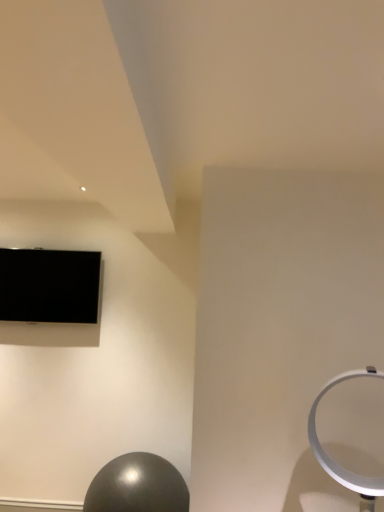
Question: Would you say shiny metallic ball at lower left is inside or outside black glossy tv at upper left?

Choices:
 (A) inside
 (B) outside

Answer: (B)

Question: From a real-world perspective, is shiny metallic ball at lower left physically located above or below black glossy tv at upper left?

Choices:
 (A) above
 (B) below

Answer: (B)

Question: Relative to black glossy tv at upper left, is shiny metallic ball at lower left in front or behind?

Choices:
 (A) behind
 (B) front

Answer: (B)

Question: Based on their positions, is black glossy tv at upper left located to the left or right of shiny metallic ball at lower left?

Choices:
 (A) left
 (B) right

Answer: (A)

Question: Considering the positions of black glossy tv at upper left and shiny metallic ball at lower left in the image, is black glossy tv at upper left taller or shorter than shiny metallic ball at lower left?

Choices:
 (A) tall
 (B) short

Answer: (A)

Question: From a real-world perspective, is black glossy tv at upper left physically located above or below shiny metallic ball at lower left?

Choices:
 (A) above
 (B) below

Answer: (A)

Question: Considering the positions of black glossy tv at upper left and shiny metallic ball at lower left in the image, is black glossy tv at upper left bigger or smaller than shiny metallic ball at lower left?

Choices:
 (A) small
 (B) big

Answer: (A)